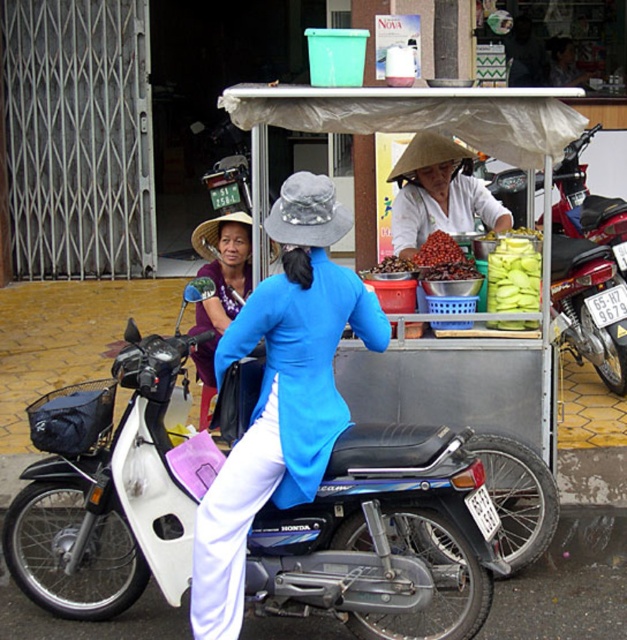
Question: Among these objects, which one is nearest to the camera?

Choices:
 (A) green matte plastic bag at center
 (B) matte purple dress at center

Answer: (A)

Question: Does white matte motorcycle at center have a smaller size compared to metallic red motorcycle at center?

Choices:
 (A) yes
 (B) no

Answer: (A)

Question: Which of the following is the closest to the observer?

Choices:
 (A) (456, 147)
 (B) (303, 406)
 (C) (440, 237)

Answer: (B)

Question: Which object appears closest to the camera in this image?

Choices:
 (A) metallic red motorcycle at center
 (B) shiny red dried beans at center
 (C) matte purple dress at center
 (D) white matte conical hat at center

Answer: (B)

Question: Is green matte plastic bag at center smaller than shiny red dried beans at center?

Choices:
 (A) yes
 (B) no

Answer: (A)

Question: Is blue fabric street vendor at center to the right of white matte conical hat at center from the viewer's perspective?

Choices:
 (A) yes
 (B) no

Answer: (B)